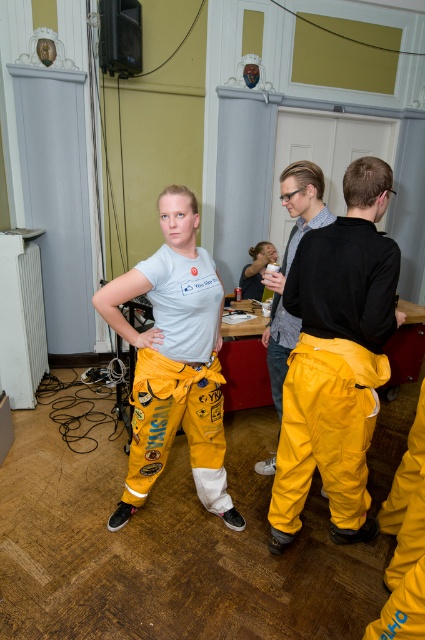
Question: Based on their relative distances, which object is nearer to the yellow fabric pants at center?

Choices:
 (A) yellow waterproof pants at center
 (B) yellow rubber pants at center
 (C) matte black shirt at center

Answer: (A)

Question: Can you confirm if yellow rubber pants at center is smaller than yellow waterproof pants at center?

Choices:
 (A) no
 (B) yes

Answer: (A)

Question: Estimate the real-world distances between objects in this image. Which object is closer to the yellow rubber pants at center?

Choices:
 (A) yellow waterproof pants at center
 (B) matte black shirt at center
 (C) yellow fabric pants at center

Answer: (A)

Question: Is yellow waterproof pants at center positioned behind matte black shirt at center?

Choices:
 (A) yes
 (B) no

Answer: (B)

Question: Is yellow fabric pants at center closer to camera compared to yellow waterproof pants at center?

Choices:
 (A) no
 (B) yes

Answer: (B)

Question: Which point is farther to the camera?

Choices:
 (A) yellow fabric pants at center
 (B) yellow waterproof pants at center

Answer: (B)